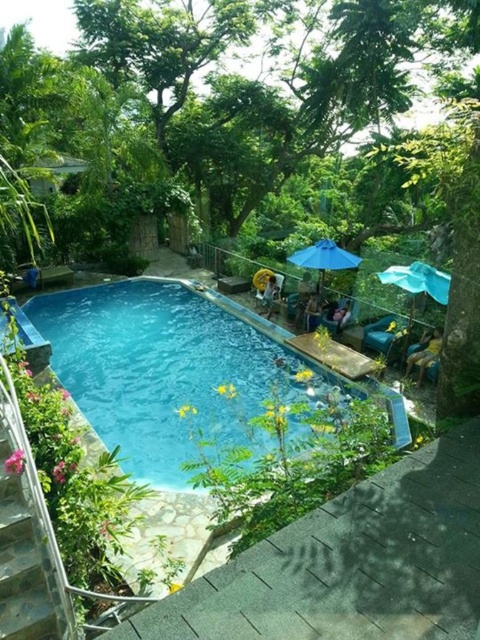
Does point (238, 385) lie in front of point (408, 269)?

No.

How much distance is there between blue concrete pool at center and blue fabric umbrella at upper right?

blue concrete pool at center and blue fabric umbrella at upper right are 15.08 feet apart.

Locate an element on the screen. This screenshot has width=480, height=640. blue concrete pool at center is located at coordinates (175, 369).

This screenshot has width=480, height=640. In order to click on blue concrete pool at center in this screenshot , I will do `click(175, 369)`.

Does blue concrete pool at center appear on the right side of blue fabric umbrella at center?

Incorrect, blue concrete pool at center is not on the right side of blue fabric umbrella at center.

Measure the distance between blue concrete pool at center and camera.

The distance of blue concrete pool at center from camera is 20.22 feet.

Between point (143, 348) and point (354, 260), which one is positioned behind?

The point (143, 348) is behind.

At what (x,y) coordinates should I click in order to perform the action: click on blue concrete pool at center. Please return your answer as a coordinate pair (x, y). This screenshot has width=480, height=640. Looking at the image, I should click on (175, 369).

Does point (405, 280) come behind point (316, 244)?

No, it is not.

In the scene shown: Is blue fabric umbrella at upper right to the left of blue fabric umbrella at center from the viewer's perspective?

In fact, blue fabric umbrella at upper right is to the right of blue fabric umbrella at center.

Between point (407, 288) and point (325, 241), which one is positioned behind?

Point (325, 241)

Identify the location of blue fabric umbrella at upper right. (419, 280).